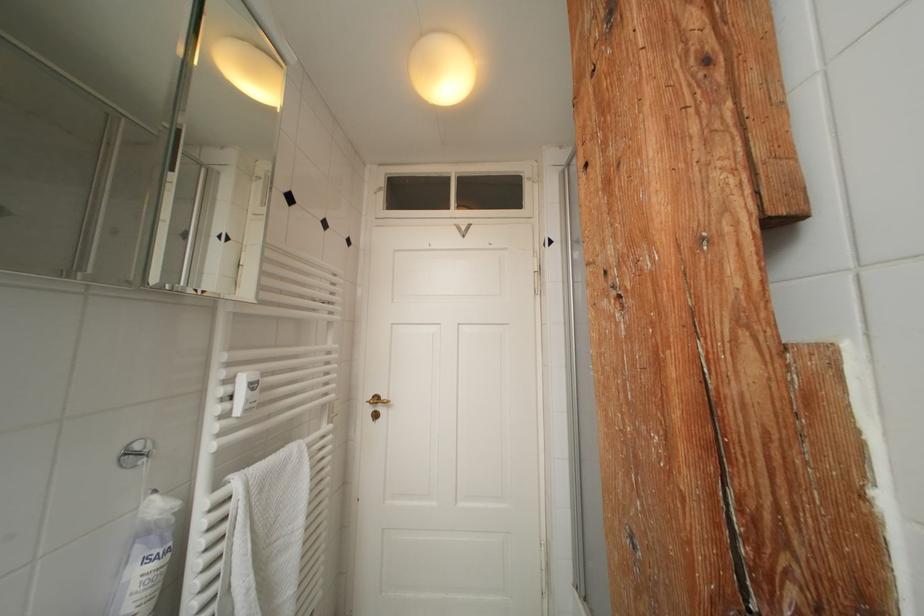
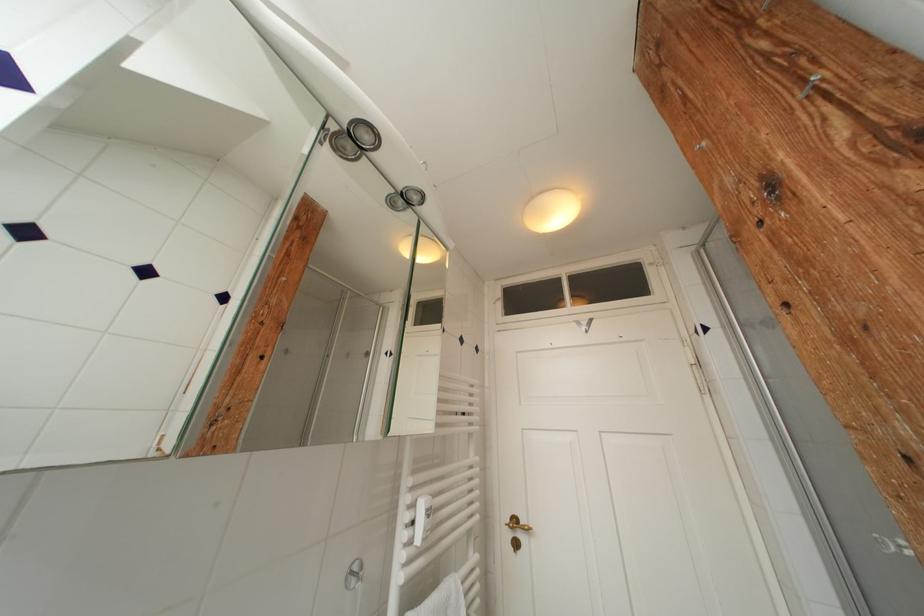
Where in the second image is the point corresponding to (x=457, y=82) from the first image?

(565, 217)